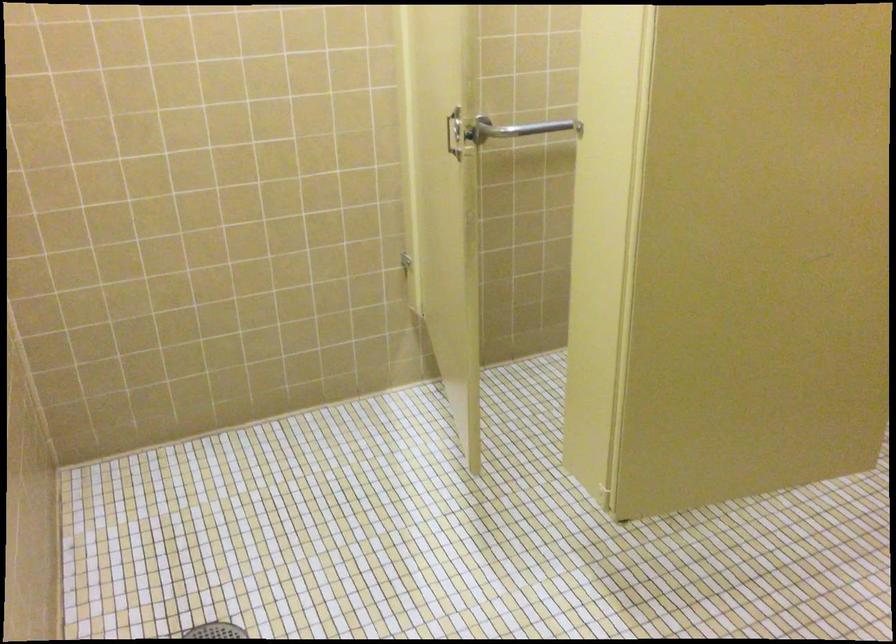
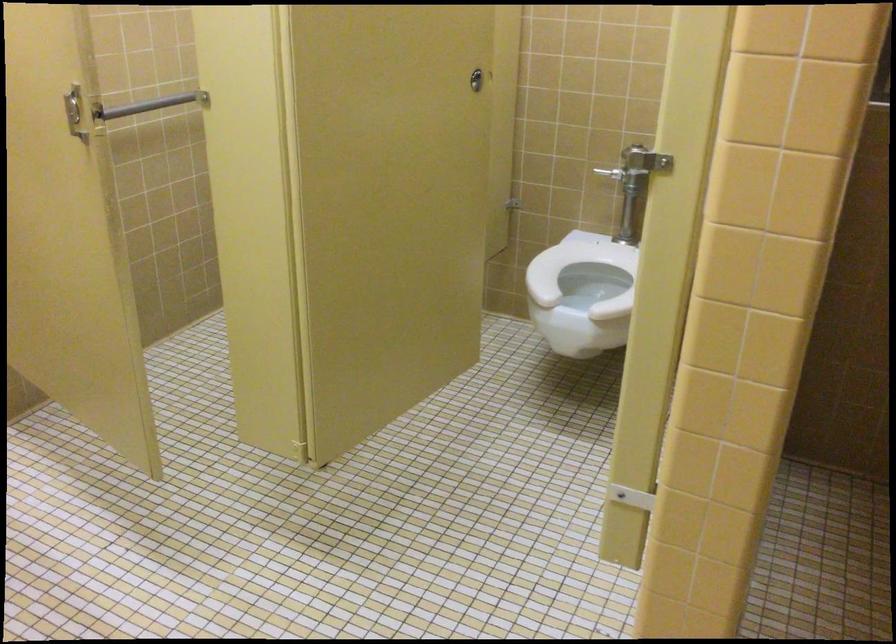
The point at (453, 122) is marked in the first image. Where is the corresponding point in the second image?

(74, 111)